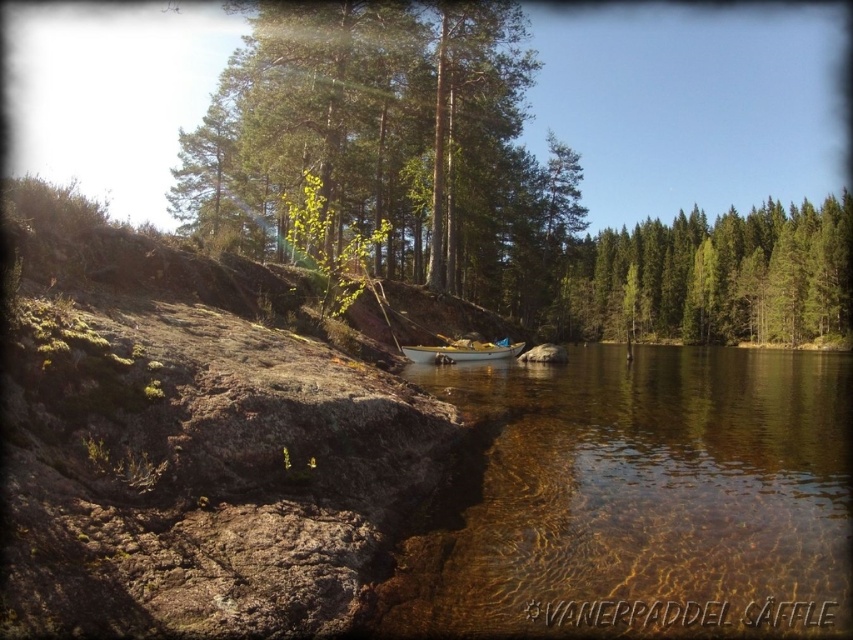
You are standing at the lakeside and want to take a photo of both the green leafy tree at upper center and the green matte tree at center. Which tree should you focus on first to ensure both are in focus?

You should focus on the green leafy tree at upper center first because it is closer to you than the green matte tree at center, so adjusting focus from near to far will help both trees be in focus.

You are standing on the lakeshore and want to retrieve an item that fell into the water. The item is floating near the white plastic canoe at center. Which direction should you look to see the reflection of the item in the clear water at center?

You should look downward toward the clear water at center, which is located below the white plastic canoe at center, to see the reflection of the floating item.

You are standing at the lakeside and see the point marked at coordinates (395, 138). What object is located at that point?

The point at (395, 138) marks a green leafy tree at upper center.